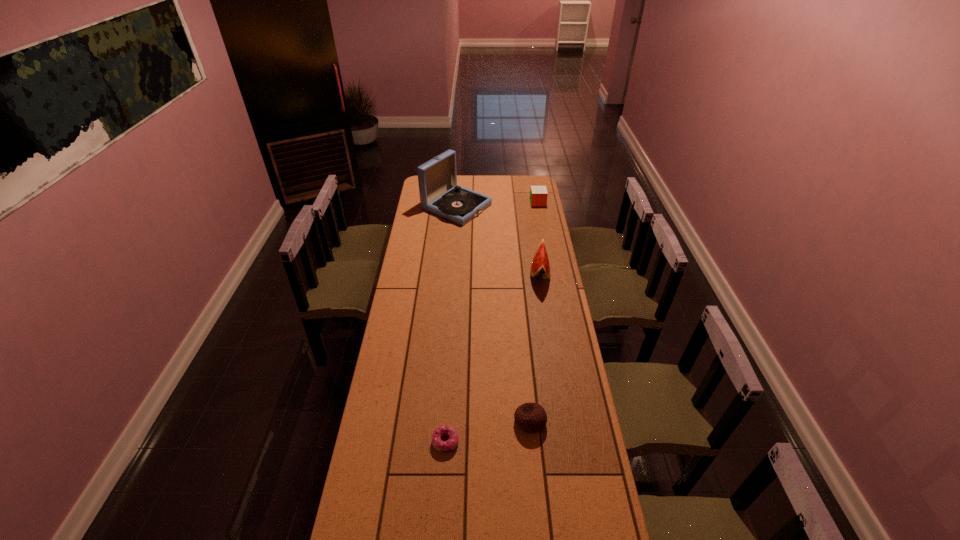
Locate an element on the screen. vacant area between the second tallest object and the third shortest object is located at coordinates (539, 238).

The image size is (960, 540). In order to click on vacant space that is in between the fourth tallest object and the tallest object in this screenshot , I will do `click(493, 314)`.

Locate an element on the screen. object that is the fourth nearest to the doughnut is located at coordinates (538, 194).

Locate an element on the screen. This screenshot has width=960, height=540. the third closest object to the phonograph record is located at coordinates (530, 417).

In order to click on free space that satisfies the following two spatial constraints: 1. on the back side of the doughnut; 2. on the right side of the third object from left to right in this screenshot , I will do `click(446, 421)`.

I want to click on vacant position in the image that satisfies the following two spatial constraints: 1. on the front side of the tallest object; 2. on the left side of the fourth tallest object, so click(441, 421).